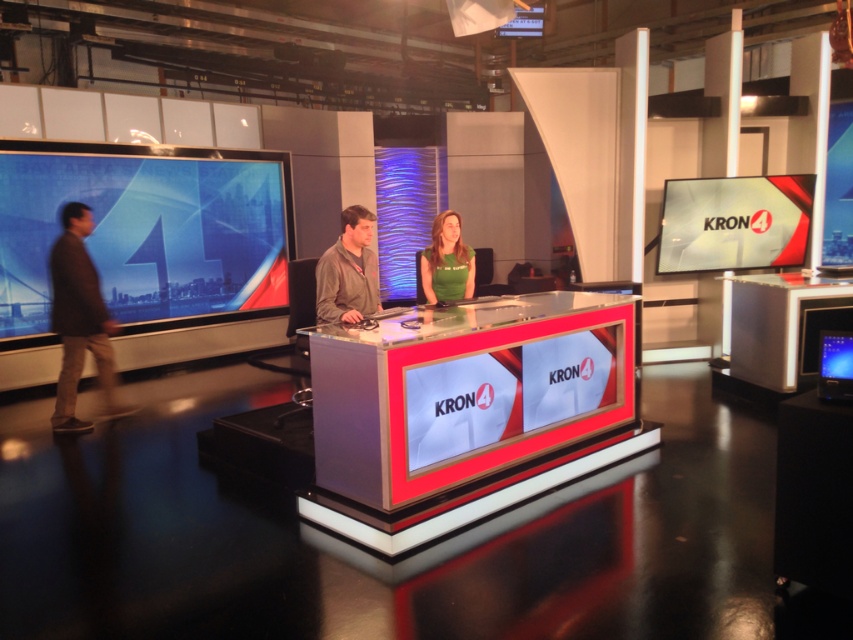
You are a guest entering the studio and need to sit between the brown leather jacket at left and the matte gray jacket at center. Can you sit there without moving either jacket?

The matte gray jacket at center is behind the brown leather jacket at left, so there is no space between them for you to sit. You would need to move at least one of the jackets to create space.

You are a camera operator in the KRON 4 news studio. You need to adjust the camera height so that both the matte gray jacket at center and the green fabric shirt at center are fully visible in the frame. Which object should you adjust the camera height to focus on first?

The matte gray jacket at center is taller than the green fabric shirt at center. Therefore, you should first adjust the camera height to ensure the taller matte gray jacket at center is fully visible, then check the shorter green fabric shirt at center.

You are a costume designer preparing for a TV show. You have two jackets available for the host and cohost. The brown leather jacket at left and the matte gray jacket at center. Which jacket is bigger in size?

The brown leather jacket at left is larger in size compared to the matte gray jacket at center.